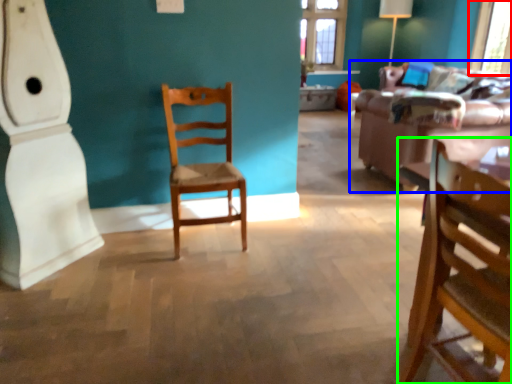
Question: Based on their relative distances, which object is farther from window screen (highlighted by a red box)? Choose from studio couch (highlighted by a blue box) and chair (highlighted by a green box).

Choices:
 (A) studio couch
 (B) chair

Answer: (B)